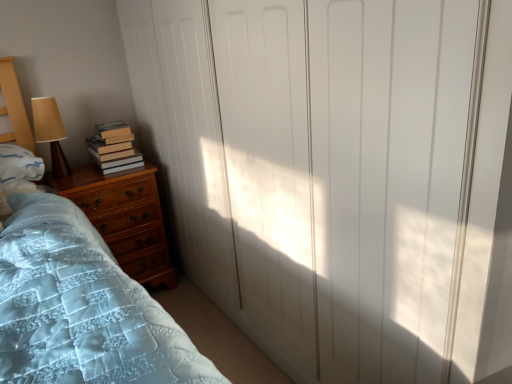
What do you see at coordinates (348, 177) in the screenshot? The width and height of the screenshot is (512, 384). I see `white matte closet doors at center` at bounding box center [348, 177].

Describe the element at coordinates (50, 132) in the screenshot. I see `brown fabric lampshade at left` at that location.

You are a GUI agent. You are given a task and a screenshot of the screen. Output one action in this format:
    pyautogui.click(x=<x>, y=<y>)
    Task: Click on the white matte closet doors at center
    
    Given the screenshot: What is the action you would take?
    pyautogui.click(x=348, y=177)

Which is correct: hardcover books at left is inside white matte closet doors at center, or outside of it?

The correct answer is: outside.

Considering the sizes of hardcover books at left and white matte closet doors at center in the image, is hardcover books at left bigger or smaller than white matte closet doors at center?

In the image, hardcover books at left appears to be smaller than white matte closet doors at center.

Looking at this image, does hardcover books at left have a lesser height compared to white matte closet doors at center?

Indeed, hardcover books at left has a lesser height compared to white matte closet doors at center.

From the image's perspective, which is above, hardcover books at left or white matte closet doors at center?

hardcover books at left appears higher in the image.

How distant is white matte closet doors at center from hardcover books at left?

A distance of 1.11 meters exists between white matte closet doors at center and hardcover books at left.

From a real-world perspective, which object stands above the other?

hardcover books at left, from a real-world perspective.

Is white matte closet doors at center inside or outside of hardcover books at left?

white matte closet doors at center is spatially situated outside hardcover books at left.

Is white matte closet doors at center bigger or smaller than hardcover books at left?

white matte closet doors at center is bigger than hardcover books at left.

From the picture: Considering the positions of objects brown fabric lampshade at left and hardcover books at left in the image provided, who is more to the right, brown fabric lampshade at left or hardcover books at left?

hardcover books at left.

Where is `book that is under the brown fabric lampshade at left (from a real-world perspective)`? The image size is (512, 384). book that is under the brown fabric lampshade at left (from a real-world perspective) is located at coordinates (114, 148).

Looking at this image, which of these two, brown fabric lampshade at left or hardcover books at left, is smaller?

With smaller size is brown fabric lampshade at left.

Is point (60, 177) behind point (112, 134)?

Yes, it is behind point (112, 134).

Does white matte closet doors at center contain brown fabric lampshade at left?

No, brown fabric lampshade at left is not inside white matte closet doors at center.

Is point (255, 308) positioned behind point (58, 150)?

That is False.

Can you confirm if white matte closet doors at center is smaller than brown fabric lampshade at left?

No, white matte closet doors at center is not smaller than brown fabric lampshade at left.

Which of these two, brown fabric lampshade at left or white matte closet doors at center, is thinner?

brown fabric lampshade at left.

Is brown fabric lampshade at left positioned with its back to white matte closet doors at center?

No, white matte closet doors at center is not at the back of brown fabric lampshade at left.

Where is `table lamp located above the white matte closet doors at center (from the image's perspective)`? The image size is (512, 384). table lamp located above the white matte closet doors at center (from the image's perspective) is located at coordinates (50, 132).

How different are the orientations of white matte closet doors at center and wooden chest of drawers at lower left in degrees?

The facing directions of white matte closet doors at center and wooden chest of drawers at lower left are 90.7 degrees apart.

Which is more to the right, white matte closet doors at center or wooden chest of drawers at lower left?

Positioned to the right is white matte closet doors at center.

Is white matte closet doors at center located outside wooden chest of drawers at lower left?

white matte closet doors at center is positioned outside wooden chest of drawers at lower left.

Does white matte closet doors at center have a greater height compared to wooden chest of drawers at lower left?

Yes.

Is point (47, 114) closer or farther from the camera than point (153, 211)?

Point (47, 114) appears to be closer to the viewer than point (153, 211).

Consider the image. From the image's perspective, is brown fabric lampshade at left located beneath wooden chest of drawers at lower left?

No, from the image's perspective, brown fabric lampshade at left is not beneath wooden chest of drawers at lower left.

The width and height of the screenshot is (512, 384). What are the coordinates of `table lamp behind the wooden chest of drawers at lower left` in the screenshot? It's located at (50, 132).

Find the location of a particular element. Image resolution: width=512 pixels, height=384 pixels. screen door in front of the hardcover books at left is located at coordinates (348, 177).

This screenshot has width=512, height=384. I want to click on screen door on the right of the hardcover books at left, so (x=348, y=177).

Looking at the image, which one is located closer to hardcover books at left, brown fabric lampshade at left or wooden chest of drawers at lower left?

wooden chest of drawers at lower left is positioned closer to the anchor hardcover books at left.

Based on their spatial positions, is brown fabric lampshade at left or white matte closet doors at center closer to hardcover books at left?

Result: brown fabric lampshade at left lies closer to hardcover books at left than the other object.

Estimate the real-world distances between objects in this image. Which object is closer to hardcover books at left, wooden chest of drawers at lower left or white matte closet doors at center?

wooden chest of drawers at lower left is closer to hardcover books at left.

Which object lies nearer to the anchor point brown fabric lampshade at left, wooden chest of drawers at lower left or white matte closet doors at center?

Based on the image, wooden chest of drawers at lower left appears to be nearer to brown fabric lampshade at left.

Looking at the image, which one is located further to wooden chest of drawers at lower left, hardcover books at left or white matte closet doors at center?

white matte closet doors at center.

Which object lies nearer to the anchor point white matte closet doors at center, brown fabric lampshade at left or hardcover books at left?

Based on the image, hardcover books at left appears to be nearer to white matte closet doors at center.

Which object lies nearer to the anchor point white matte closet doors at center, wooden chest of drawers at lower left or brown fabric lampshade at left?

Based on the image, wooden chest of drawers at lower left appears to be nearer to white matte closet doors at center.

From the image, which object appears to be nearer to brown fabric lampshade at left, white matte closet doors at center or hardcover books at left?

Among the two, hardcover books at left is located nearer to brown fabric lampshade at left.

Locate an element on the screen. This screenshot has width=512, height=384. book between brown fabric lampshade at left and wooden chest of drawers at lower left from top to bottom is located at coordinates [114, 148].

Find the location of a particular element. chest of drawers between white matte closet doors at center and brown fabric lampshade at left along the z-axis is located at coordinates click(124, 218).

At what (x,y) coordinates should I click in order to perform the action: click on table lamp located between white matte closet doors at center and hardcover books at left in the depth direction. Please return your answer as a coordinate pair (x, y). The width and height of the screenshot is (512, 384). Looking at the image, I should click on pyautogui.click(x=50, y=132).

Find the location of `the chest of drawers located between white matte closet doors at center and hardcover books at left in the depth direction`. the chest of drawers located between white matte closet doors at center and hardcover books at left in the depth direction is located at coordinates (124, 218).